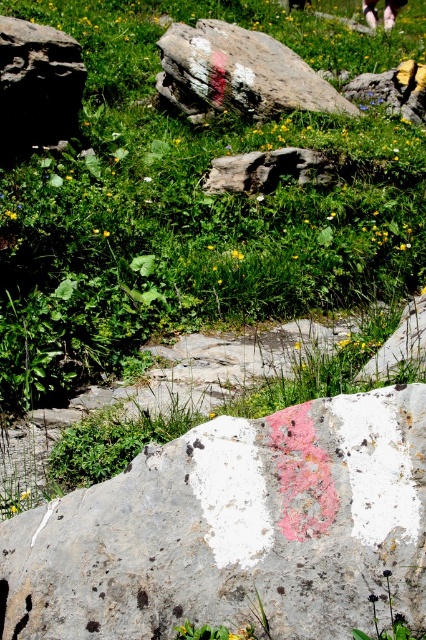
You are hiking and come across the white painted rock at center and the pink fabric pants at upper center. Which object is nearer to you?

The white painted rock at center is closer to the viewer than the pink fabric pants at upper center.

You are hiking and come across a large white painted rock at center and a white stone at upper center. Which one is nearer to you?

The white painted rock at center is closer to the viewer than the white stone at upper center.